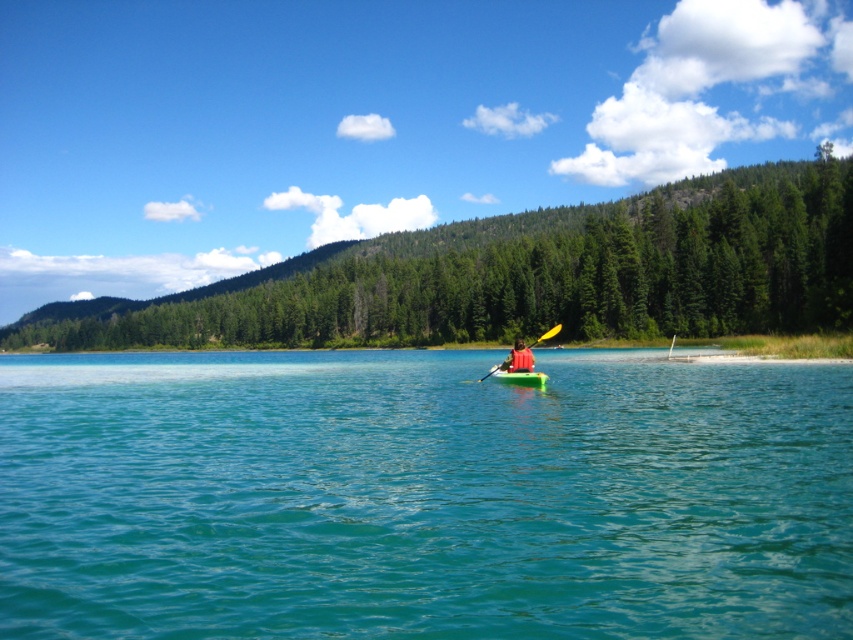
Question: Which of the following is the farthest from the observer?

Choices:
 (A) green plastic canoe at center
 (B) green plastic kayak at center

Answer: (B)

Question: Where is clear blue water at center located in relation to green plastic canoe at center in the image?

Choices:
 (A) left
 (B) right

Answer: (A)

Question: Which object appears closest to the camera in this image?

Choices:
 (A) green matte tree at upper center
 (B) yellow plastic paddle at center
 (C) green plastic kayak at center

Answer: (C)

Question: Does green plastic canoe at center have a larger size compared to green plastic kayak at center?

Choices:
 (A) no
 (B) yes

Answer: (A)

Question: Among these objects, which one is nearest to the camera?

Choices:
 (A) green plastic kayak at center
 (B) green plastic canoe at center

Answer: (B)

Question: Can you confirm if clear blue water at center is wider than yellow plastic paddle at center?

Choices:
 (A) no
 (B) yes

Answer: (B)